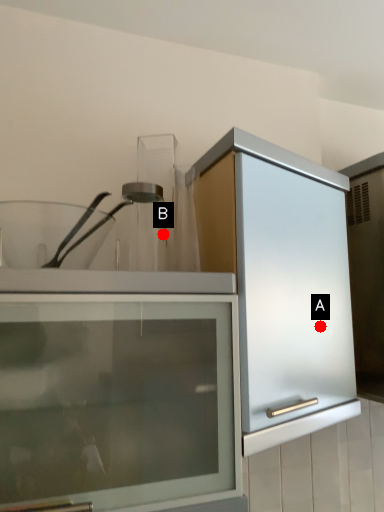
Question: Two points are circled on the image, labeled by A and B beside each circle. Which point is further to the camera?

Choices:
 (A) A is further
 (B) B is further

Answer: (B)